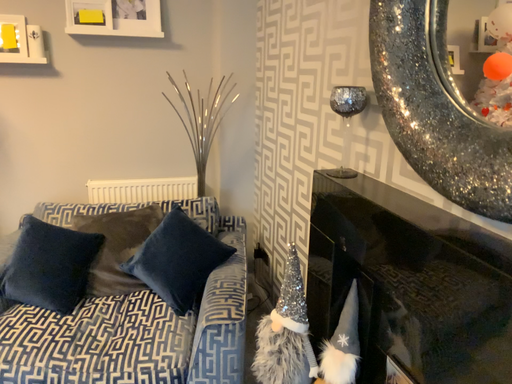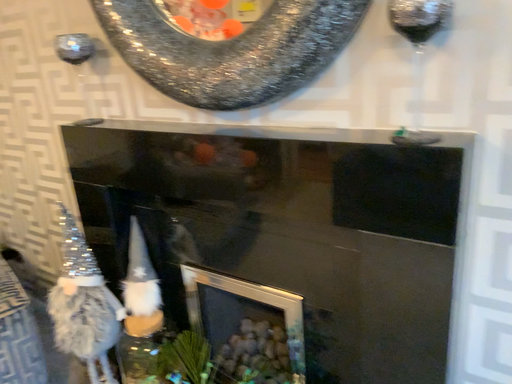
Question: How did the camera likely rotate when shooting the video?

Choices:
 (A) rotated left
 (B) rotated right

Answer: (B)